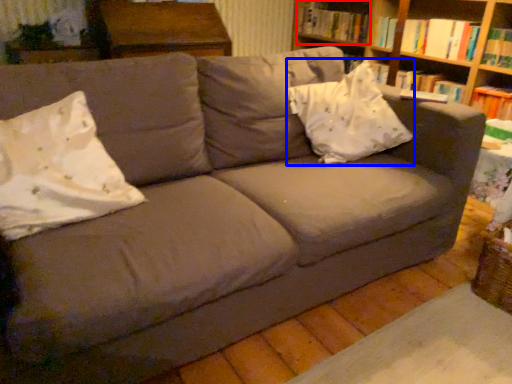
Question: Which point is further to the camera, book (highlighted by a red box) or throw pillow (highlighted by a blue box)?

Choices:
 (A) book
 (B) throw pillow

Answer: (A)